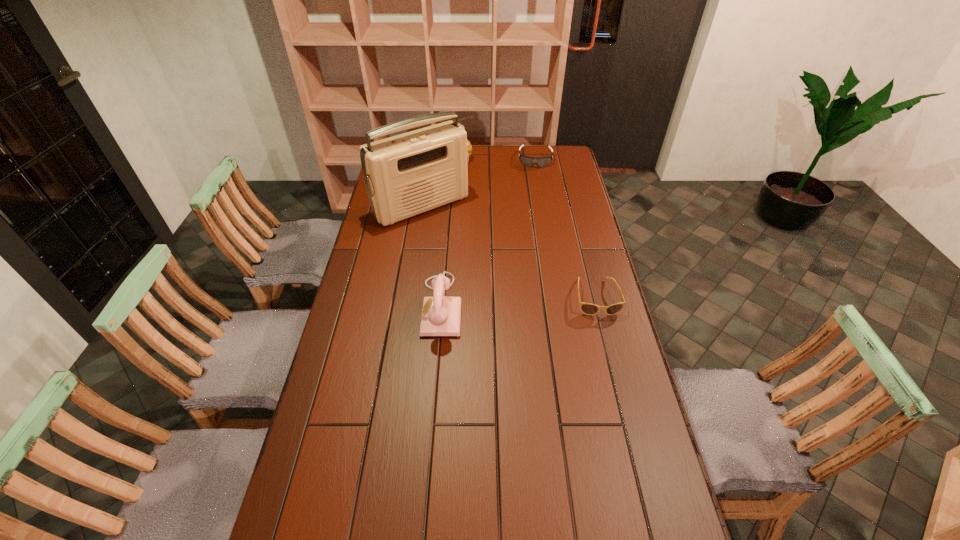
The height and width of the screenshot is (540, 960). Identify the location of vacant space on the desktop that is between the fourth shortest object and the sunglasses and is positioned on the front and sides of the goggles. (530, 301).

Find the location of a particular element. This screenshot has height=540, width=960. free spot on the desktop that is between the telephone and the sunglasses and is positioned on the front-facing side of the radio receiver is located at coordinates (511, 302).

Image resolution: width=960 pixels, height=540 pixels. In order to click on free spot on the desktop that is between the telephone and the sunglasses and is positioned on the stem side of the third shortest object in this screenshot , I will do `click(510, 302)`.